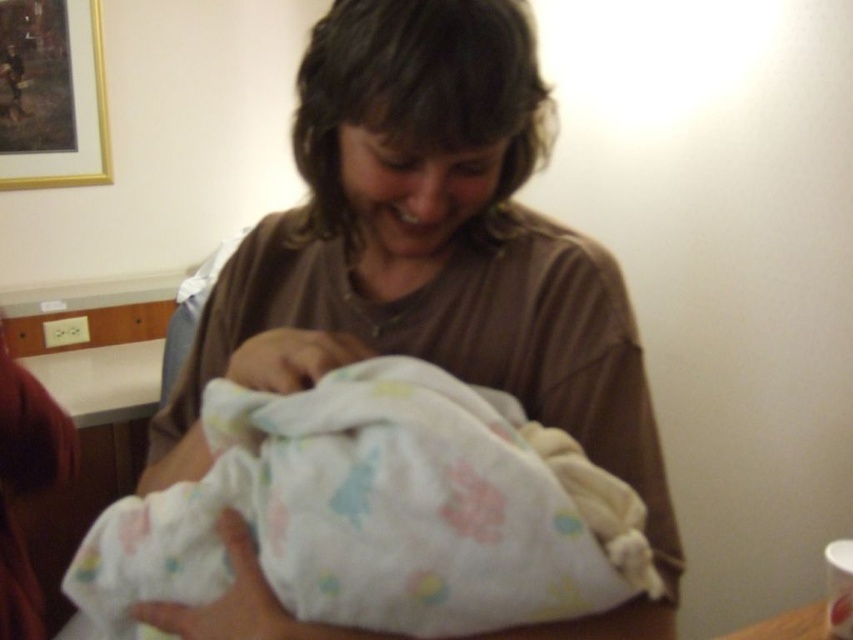
You are a photographer adjusting your camera settings to capture the best shot of the scene. You notice two points in the image at coordinates point (669, 586) and point (230, 506). Which point is closer to your camera lens?

Point (669, 586) is further to the viewer than point (230, 506), so the point closer to the camera lens is point (230, 506).

You are a photographer setting up a photo shoot in this room. You need to decide whether to place a small lamp in front of the white soft cloth at center or behind the fluffy white blanket at center to avoid casting shadows on the main subject. Based on the scene description, where should you place the lamp?

The fluffy white blanket at center is behind the white soft cloth at center, so placing the lamp in front of the white soft cloth at center would avoid casting shadows on the main subject.